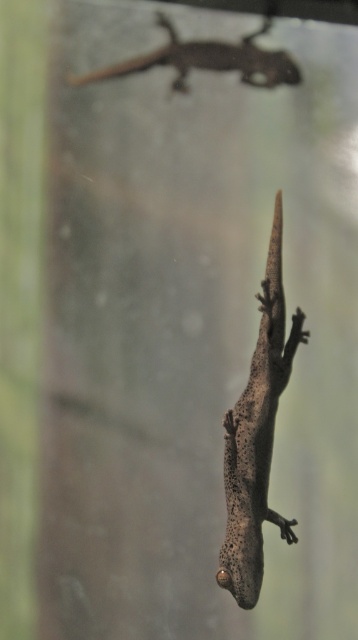
In the scene shown: You are a photographer trying to focus on the gecko closest to you in the image. You notice two points marked in the image. Which point, point (263, 376) or point (248, 60), is closer to you and should be your focus point?

Point (263, 376) is closer to the viewer than point (248, 60), so you should focus on point (263, 376).

You are a nature photographer aiming to capture both the speckled gray lizard at center and the smooth brown lizard at upper center in the same frame. Based on their positions, which lizard would appear closer to the camera in your photo?

The speckled gray lizard at center is positioned under the smooth brown lizard at upper center, so the speckled gray lizard at center would appear closer to the camera in the photo.